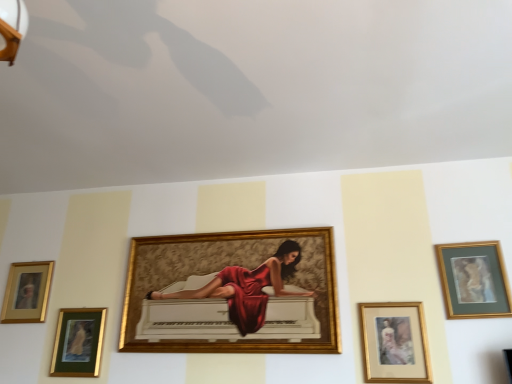
Question: Is gold-framed portrait at lower right, which is the 2th picture frame from right to left, to the left or to the right of gold-framed painting at center, placed as the third picture frame when sorted from left to right, in the image?

Choices:
 (A) left
 (B) right

Answer: (B)

Question: From a real-world perspective, is gold-framed portrait at lower right, which is the 2th picture frame from right to left, positioned above or below gold-framed painting at center, placed as the third picture frame when sorted from left to right?

Choices:
 (A) below
 (B) above

Answer: (A)

Question: Estimate the real-world distances between objects in this image. Which object is farther from the gold/glass picture frame at lower left, the 4th picture frame positioned from the right?

Choices:
 (A) gold-framed painting at center, placed as the third picture frame when sorted from left to right
 (B) gold/glossy picture frame at lower left, the 5th picture frame viewed from the right
 (C) gold-framed artwork at upper right, placed as the first picture frame when sorted from right to left
 (D) gold-framed portrait at lower right, marked as the fourth picture frame in a left-to-right arrangement

Answer: (C)

Question: Estimate the real-world distances between objects in this image. Which object is closer to the gold-framed artwork at upper right, placed as the first picture frame when sorted from right to left?

Choices:
 (A) gold-framed painting at center, which appears as the third picture frame when viewed from the right
 (B) gold/glass picture frame at lower left, the 4th picture frame positioned from the right
 (C) gold/glossy picture frame at lower left, arranged as the 1th picture frame when viewed from the left
 (D) gold-framed portrait at lower right, which is the 2th picture frame from right to left

Answer: (D)